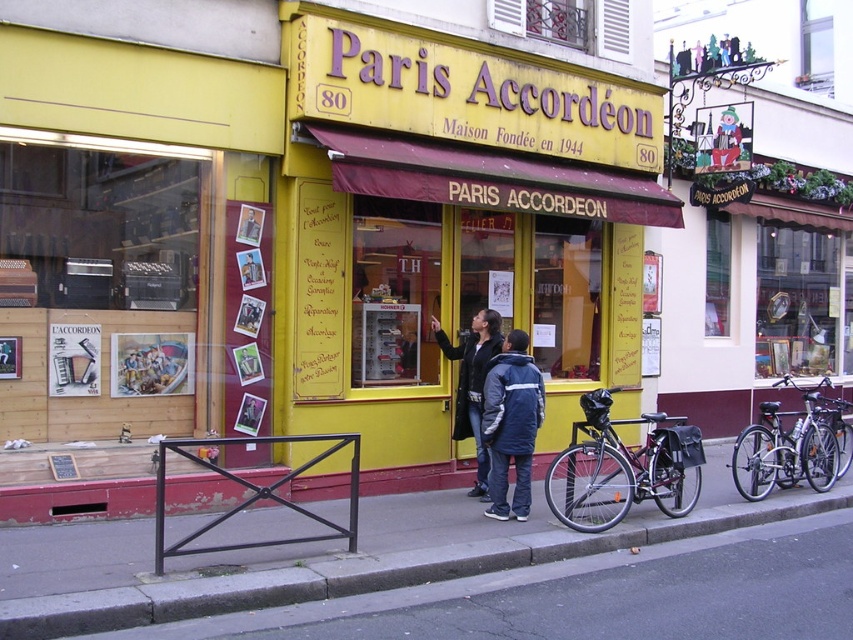
You are a delivery person who needs to load both the black matte bicycle at center and the silver metallic bicycle at right into your truck. The truck has a loading ramp that can only accommodate items placed below a certain height. Which bicycle should you load first to ensure the taller one is placed lower in the truck?

The black matte bicycle at center is above the silver metallic bicycle at right in the image. To ensure the taller one is placed lower in the truck, you should load the black matte bicycle at center first since it is positioned higher and might be the taller one needing to be placed lower to accommodate the other beneath it.

You are a delivery person who needs to park your black matte bicycle at center near the entrance of Paris Accord?on. Based on the scene description, can you estimate whether the bicycle will block the entrance?

The black matte bicycle at center is located at point (625,465), which is near the entrance of the shop. Since the coordinates are close to the entrance area, the bicycle may block the entrance if parked there.